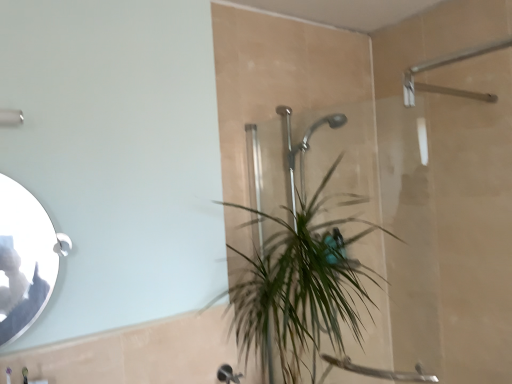
Question: Is silver/metallic mirror at left shorter than matte silver shower at upper left?

Choices:
 (A) no
 (B) yes

Answer: (A)

Question: Is silver/metallic mirror at left positioned beyond the bounds of matte silver shower at upper left?

Choices:
 (A) yes
 (B) no

Answer: (A)

Question: Considering the relative sizes of silver/metallic mirror at left and matte silver shower at upper left in the image provided, is silver/metallic mirror at left bigger than matte silver shower at upper left?

Choices:
 (A) no
 (B) yes

Answer: (B)

Question: Is silver/metallic mirror at left far from matte silver shower at upper left?

Choices:
 (A) yes
 (B) no

Answer: (B)

Question: Are silver/metallic mirror at left and matte silver shower at upper left beside each other?

Choices:
 (A) no
 (B) yes

Answer: (A)

Question: Considering the relative positions of green leafy plant at center and matte silver shower at upper left in the image provided, is green leafy plant at center to the left or to the right of matte silver shower at upper left?

Choices:
 (A) left
 (B) right

Answer: (B)

Question: From a real-world perspective, is green leafy plant at center physically located above or below matte silver shower at upper left?

Choices:
 (A) below
 (B) above

Answer: (A)

Question: Is point (281, 261) closer or farther from the camera than point (13, 115)?

Choices:
 (A) farther
 (B) closer

Answer: (A)

Question: From the image's perspective, is green leafy plant at center above or below matte silver shower at upper left?

Choices:
 (A) above
 (B) below

Answer: (B)

Question: Considering the positions of matte silver shower at upper left and green leafy plant at center in the image, is matte silver shower at upper left taller or shorter than green leafy plant at center?

Choices:
 (A) tall
 (B) short

Answer: (B)

Question: Considering the relative positions of matte silver shower at upper left and green leafy plant at center in the image provided, is matte silver shower at upper left to the left or to the right of green leafy plant at center?

Choices:
 (A) right
 (B) left

Answer: (B)

Question: Looking at the image, does matte silver shower at upper left seem bigger or smaller compared to green leafy plant at center?

Choices:
 (A) small
 (B) big

Answer: (A)

Question: Considering the positions of point (11, 110) and point (258, 286), is point (11, 110) closer or farther from the camera than point (258, 286)?

Choices:
 (A) closer
 (B) farther

Answer: (A)

Question: Considering the relative positions of green leafy plant at center and silver/metallic mirror at left in the image provided, is green leafy plant at center to the left or to the right of silver/metallic mirror at left?

Choices:
 (A) right
 (B) left

Answer: (A)

Question: Is point (276, 329) closer or farther from the camera than point (1, 311)?

Choices:
 (A) closer
 (B) farther

Answer: (B)